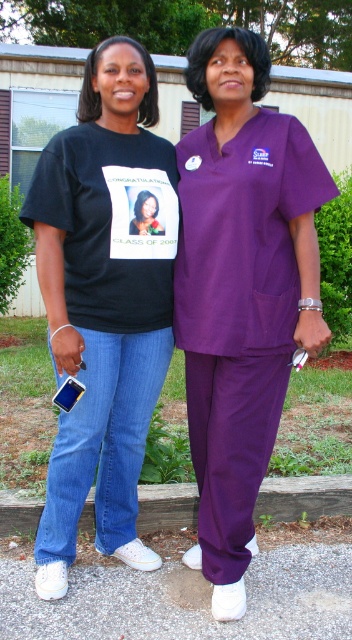
You are a photographer taking a picture of the two people in front of the building. You want to ensure that the purple scrubs at center are clearly visible in the photo. Where should you position yourself relative to the point marked at point (241, 291)?

You should position yourself directly at point (241, 291) to ensure the purple scrubs at center are clearly visible, as that is where they are located.

You are standing in front of a building with a corrugated metal roof. You see a point at coordinates (91, 353). Can you reach it without moving your feet?

The point at coordinates (91, 353) is 9.01 feet away from you, so you cannot reach it without moving your feet.